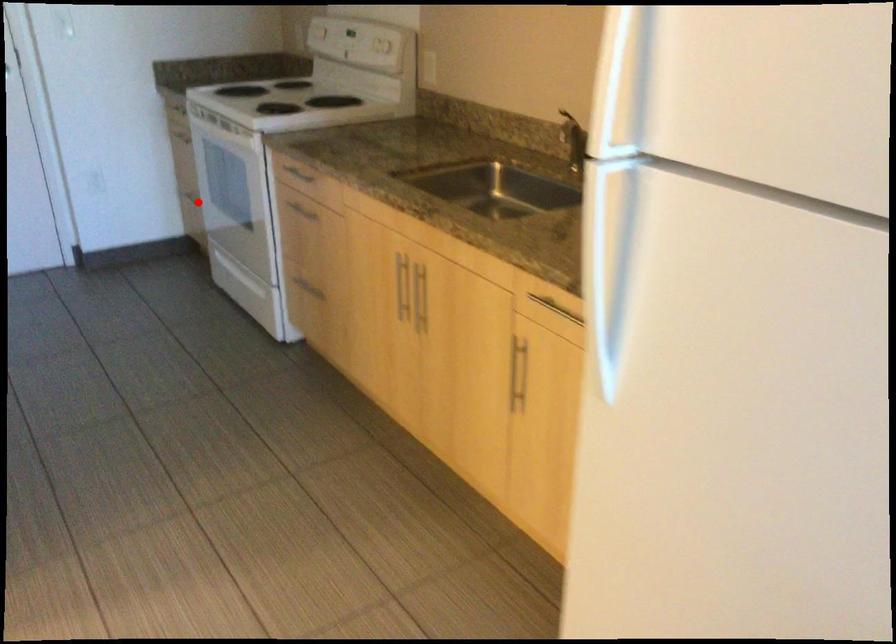
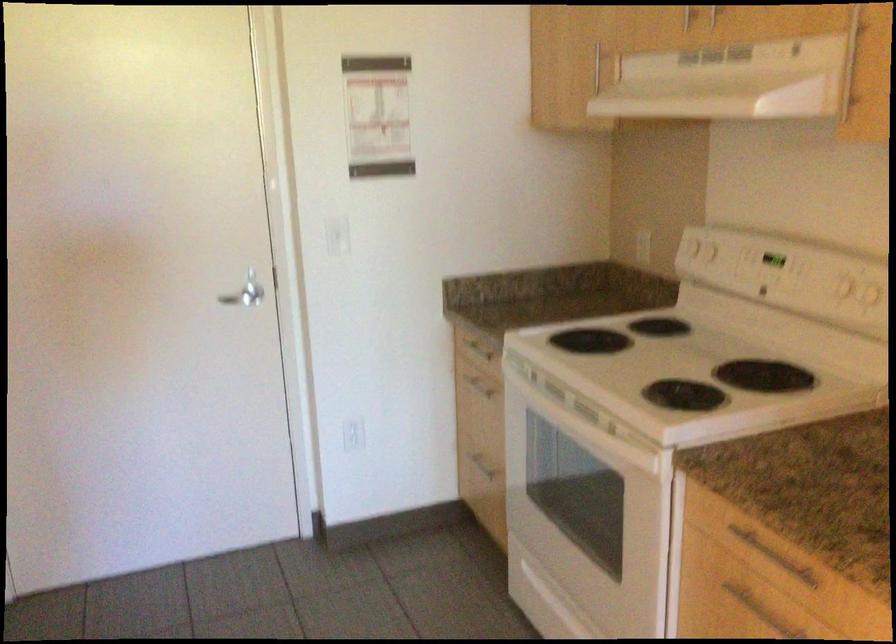
The point at the highlighted location is marked in the first image. Where is the corresponding point in the second image?

(478, 462)